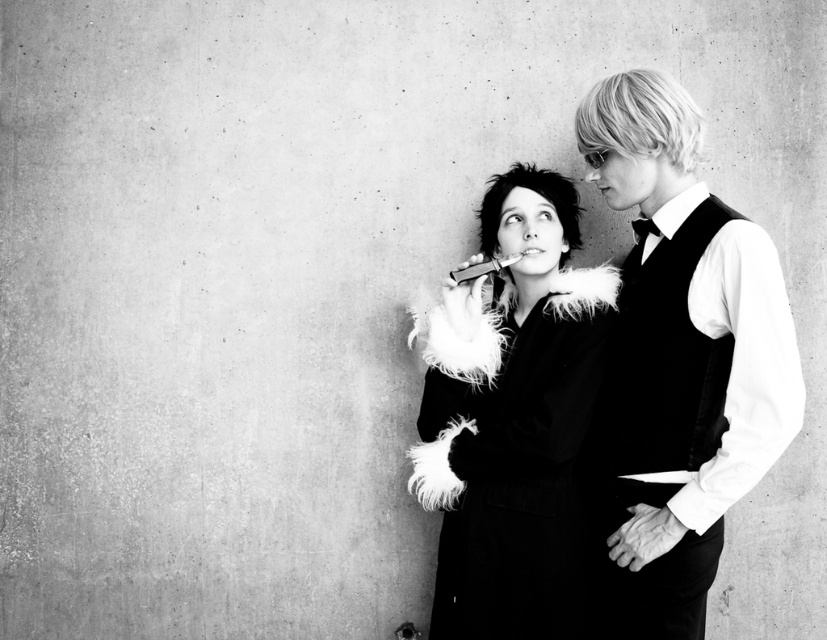
What is the object located at the coordinates point (679, 360) in the image?

The point (679, 360) indicates the feathered black vest at center.

You are a tailor observing the feathered black vest at center and the feathered black coat at center in the image. Which one has a taller height?

The feathered black vest at center has a greater height compared to the feathered black coat at center.